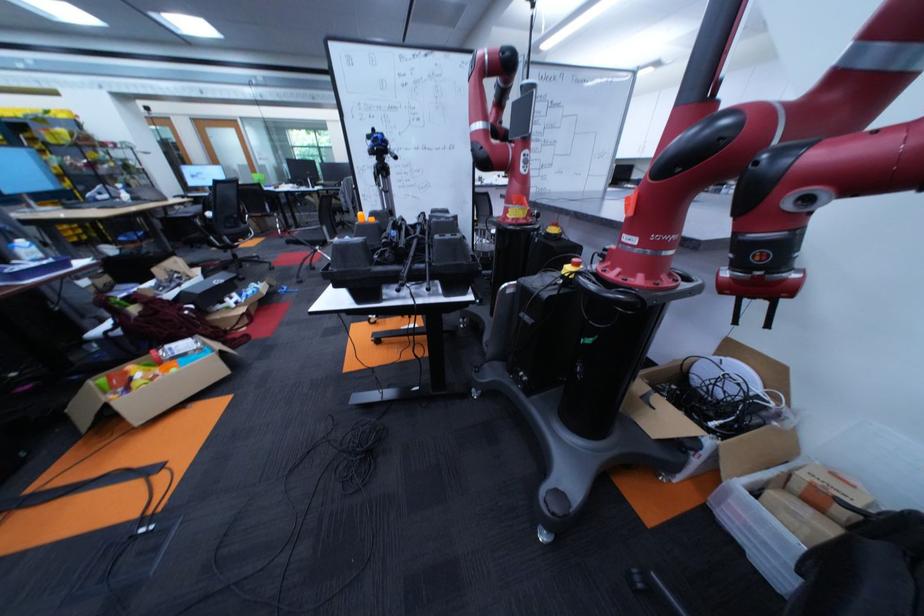
Where would you sit the black chair sitting surface? Please return your answer as a coordinate pair (x, y).

(227, 222)